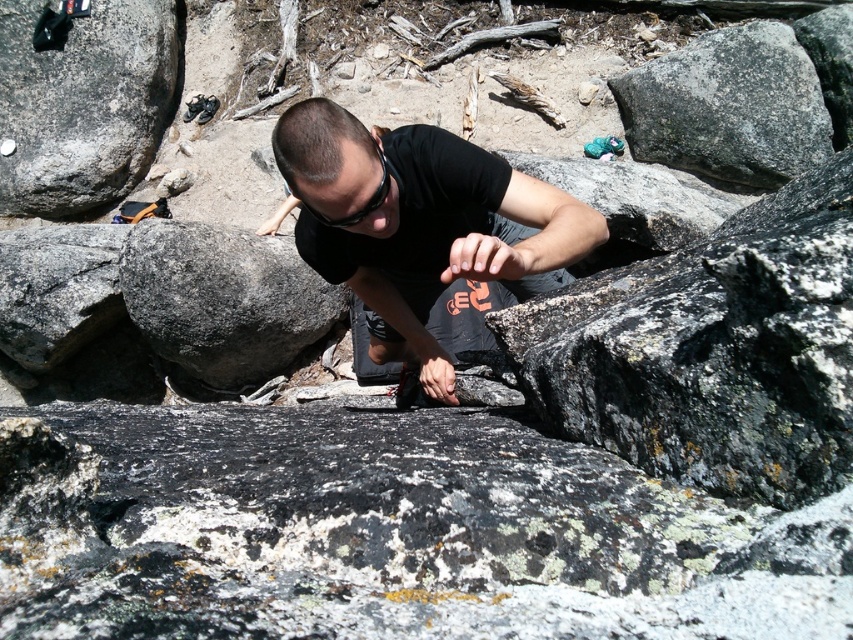
Is gray rough boulder at center-left bigger than gray rough rock at left?

Correct, gray rough boulder at center-left is larger in size than gray rough rock at left.

Does gray rough boulder at center-left have a greater height compared to gray rough rock at left?

Correct, gray rough boulder at center-left is much taller as gray rough rock at left.

Is point (270, 237) closer to camera compared to point (51, 230)?

Yes, it is in front of point (51, 230).

Identify the location of gray rough boulder at center-left. (223, 298).

Does black matte shirt at center appear on the left side of gray rough boulder at center-left?

No, black matte shirt at center is not to the left of gray rough boulder at center-left.

This screenshot has height=640, width=853. What do you see at coordinates (421, 224) in the screenshot?
I see `black matte shirt at center` at bounding box center [421, 224].

At what (x,y) coordinates should I click in order to perform the action: click on black matte shirt at center. Please return your answer as a coordinate pair (x, y). The image size is (853, 640). Looking at the image, I should click on (421, 224).

Where is `black matte shirt at center`? The image size is (853, 640). black matte shirt at center is located at coordinates (421, 224).

How distant is black matte shirt at center from smooth gray rock at left?

The distance of black matte shirt at center from smooth gray rock at left is 2.42 meters.

Is black matte shirt at center further to camera compared to smooth gray rock at left?

No, black matte shirt at center is in front of smooth gray rock at left.

At what (x,y) coordinates should I click in order to perform the action: click on black matte shirt at center. Please return your answer as a coordinate pair (x, y). The height and width of the screenshot is (640, 853). Looking at the image, I should click on (421, 224).